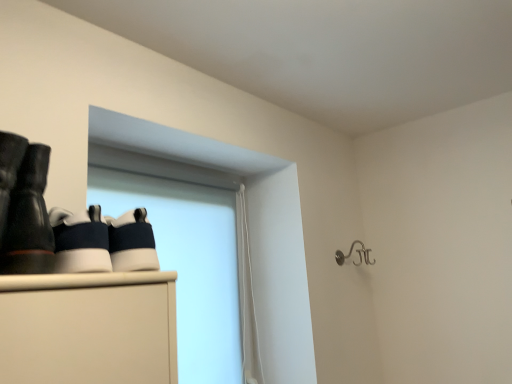
Question: Considering the positions of point (40, 273) and point (370, 264), is point (40, 273) closer or farther from the camera than point (370, 264)?

Choices:
 (A) farther
 (B) closer

Answer: (B)

Question: Looking at their shapes, would you say matte black boots at left is wider or thinner than silver metallic hook at upper right?

Choices:
 (A) wide
 (B) thin

Answer: (A)

Question: Based on their relative distances, which object is farther from the matte black boots at left?

Choices:
 (A) silver metallic hook at upper right
 (B) white matte window screen at upper left

Answer: (A)

Question: Based on their relative distances, which object is farther from the white matte window screen at upper left?

Choices:
 (A) silver metallic hook at upper right
 (B) matte black boots at left

Answer: (B)